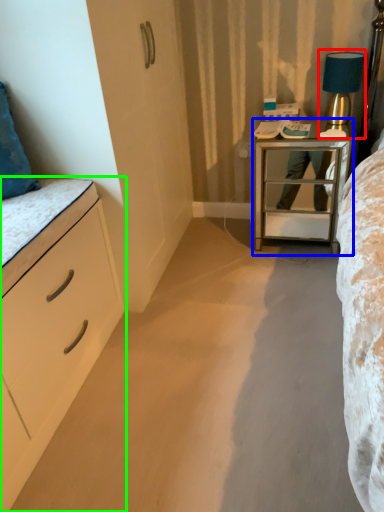
Question: Which object is positioned farthest from bedside lamp (highlighted by a red box)? Select from nightstand (highlighted by a blue box) and chest of drawers (highlighted by a green box).

Choices:
 (A) nightstand
 (B) chest of drawers

Answer: (B)